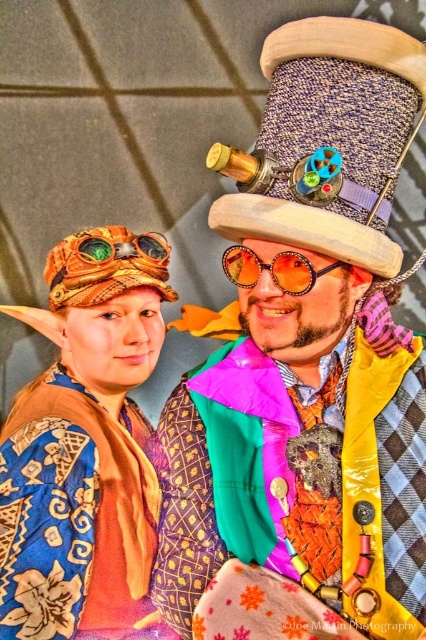
Which is more to the left, multicolored fabric coat at center or orange woven hat at upper left?

orange woven hat at upper left

The width and height of the screenshot is (426, 640). Identify the location of multicolored fabric coat at center. (310, 349).

Is point (423, 566) farther from viewer compared to point (144, 268)?

No, it is in front of (144, 268).

Locate an element on the screen. multicolored fabric coat at center is located at coordinates (310, 349).

Does multicolored fabric coat at center have a greater height compared to shiny orange plastic goggles at center?

Indeed, multicolored fabric coat at center has a greater height compared to shiny orange plastic goggles at center.

Does multicolored fabric coat at center have a lesser height compared to shiny orange plastic goggles at center?

No.

Between point (310, 26) and point (261, 260), which one is positioned behind?

Positioned behind is point (261, 260).

The image size is (426, 640). I want to click on multicolored fabric coat at center, so click(310, 349).

Is woven fabric hat at upper center smaller than orange woven hat at upper left?

Incorrect, woven fabric hat at upper center is not smaller in size than orange woven hat at upper left.

Is woven fabric hat at upper center shorter than orange woven hat at upper left?

Incorrect, woven fabric hat at upper center's height does not fall short of orange woven hat at upper left's.

Is point (238, 180) positioned before point (140, 273)?

Yes, point (238, 180) is in front of point (140, 273).

The image size is (426, 640). In order to click on woven fabric hat at upper center in this screenshot , I will do `click(328, 141)`.